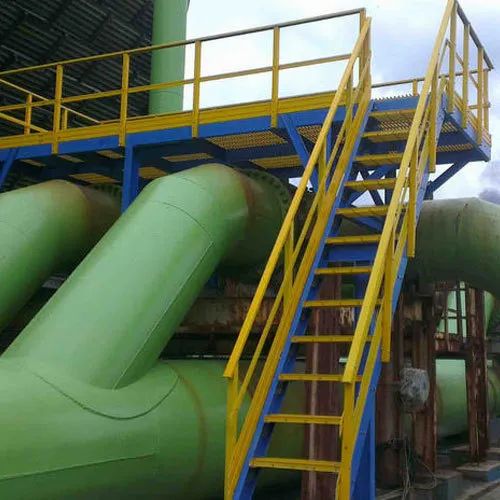
Locate an element on the screen. This screenshot has width=500, height=500. 2 colors in the stairs is located at coordinates (350, 460), (364, 454).